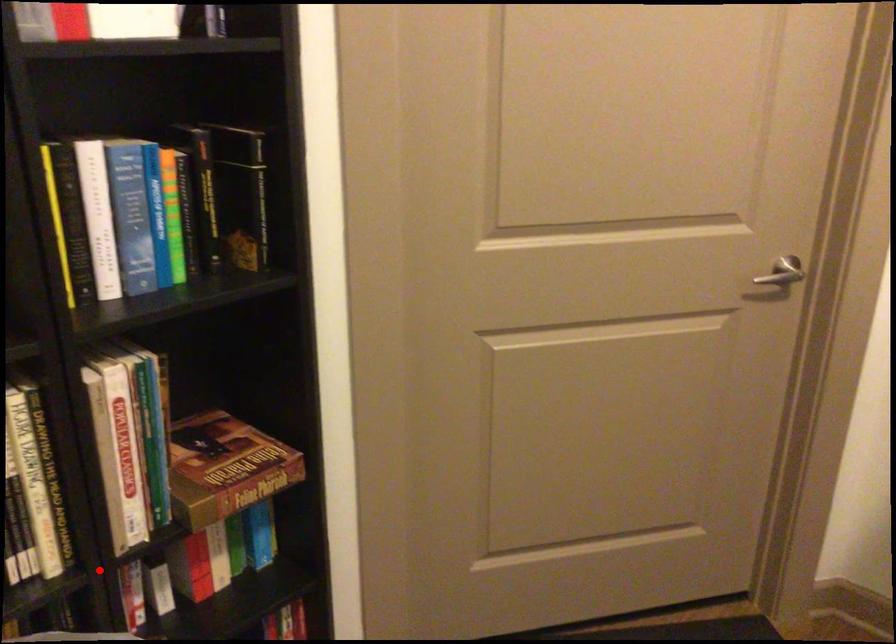
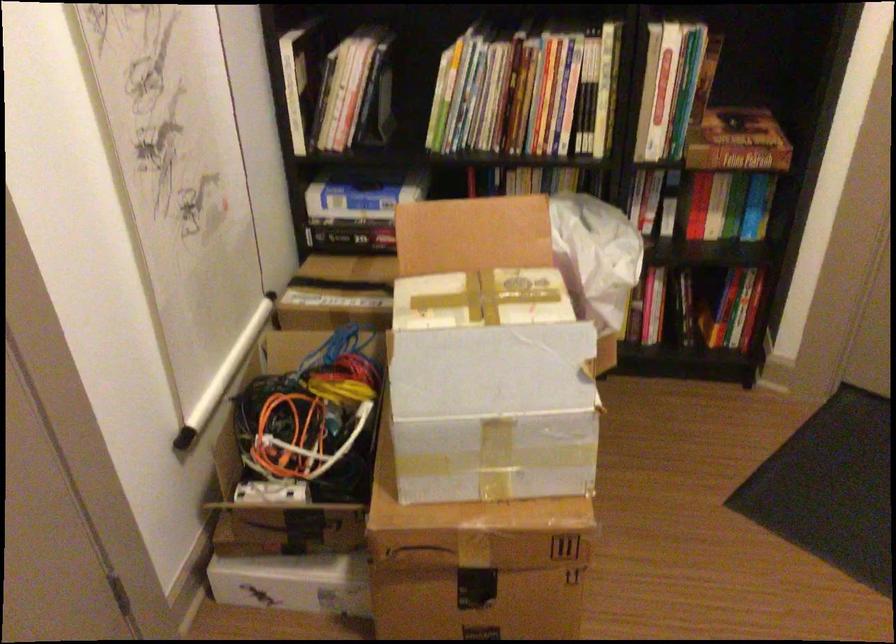
The point at the highlighted location is marked in the first image. Where is the corresponding point in the second image?

(618, 161)